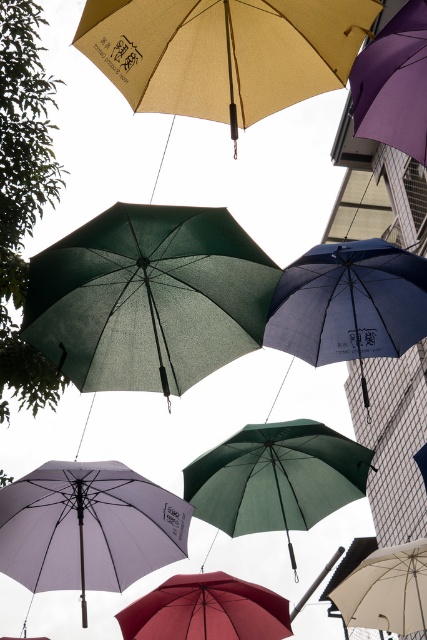
You are an artist planning to add a new yellow umbrella to the installation. You want to place it between the green matte umbrella at upper center and the matte red umbrella at center. Based on their current positions, where should you position the yellow umbrella?

The green matte umbrella at upper center is positioned on the left side of matte red umbrella at center, so you should place the yellow umbrella between them, to the right of the green matte umbrella at upper center and to the left of the matte red umbrella at center.

You are an artist planning to paint the scene of suspended umbrellas. You want to ensure the green matte umbrella at upper center and the matte red umbrella at center are positioned correctly in terms of depth. Which umbrella should appear larger in your painting to accurately depict their spatial relationship?

The green matte umbrella at upper center should appear larger in your painting because it is closer to the viewer than the matte red umbrella at center, and objects closer to the viewer typically appear larger.

You are an artist observing the suspended umbrellas. You notice the green matte umbrella at upper center and the matte purple umbrella at center. Which umbrella is closer to you?

The green matte umbrella at upper center is closer to you because it is in front of the matte purple umbrella at center.